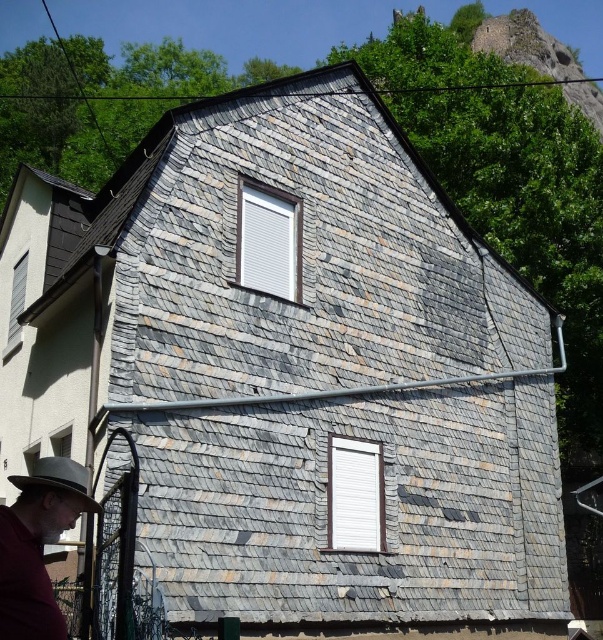
Question: Can you confirm if gray felt hat at lower left is positioned above gray felt fedora at lower left?

Choices:
 (A) no
 (B) yes

Answer: (B)

Question: Which point is closer to the camera?

Choices:
 (A) gray felt hat at lower left
 (B) gray felt fedora at lower left

Answer: (A)

Question: Can you confirm if gray felt hat at lower left is wider than gray felt fedora at lower left?

Choices:
 (A) no
 (B) yes

Answer: (A)

Question: Can you confirm if gray felt hat at lower left is positioned to the left of gray felt fedora at lower left?

Choices:
 (A) no
 (B) yes

Answer: (A)

Question: Which point is closer to the camera?

Choices:
 (A) (78, 493)
 (B) (22, 499)

Answer: (B)

Question: Which of the following is the closest to the observer?

Choices:
 (A) (74, 481)
 (B) (25, 483)

Answer: (B)